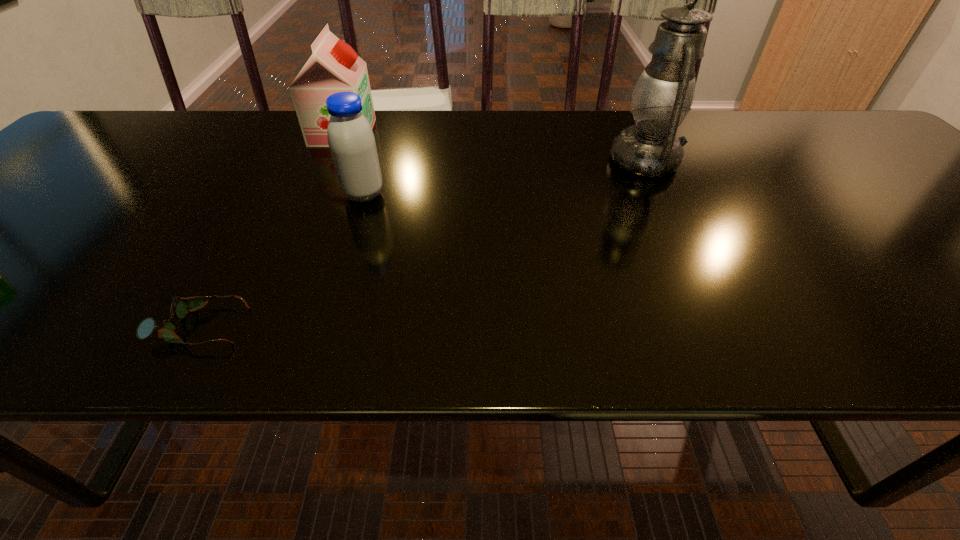
Find the location of a particular element. vacant space that's between the shortest object and the farther soya milk is located at coordinates (271, 230).

Where is `free point between the rightmost object and the farther soya milk`? free point between the rightmost object and the farther soya milk is located at coordinates (494, 146).

Identify which object is located as the third nearest to the nearest object. Please provide its 2D coordinates. Your answer should be formatted as a tuple, i.e. [(x, y)], where the tuple contains the x and y coordinates of a point satisfying the conditions above.

[(663, 95)]

Choose which object is the nearest neighbor to the nearest object. Please provide its 2D coordinates. Your answer should be formatted as a tuple, i.e. [(x, y)], where the tuple contains the x and y coordinates of a point satisfying the conditions above.

[(352, 144)]

Where is `vacant space that satisfies the following two spatial constraints: 1. with the cap open on the farther soya milk; 2. on the back side of the nearer soya milk`? vacant space that satisfies the following two spatial constraints: 1. with the cap open on the farther soya milk; 2. on the back side of the nearer soya milk is located at coordinates (315, 194).

Identify the location of free location that satisfies the following two spatial constraints: 1. with the cap open on the farther soya milk; 2. on the right side of the rightmost object. (330, 161).

The width and height of the screenshot is (960, 540). Identify the location of free point that satisfies the following two spatial constraints: 1. on the back side of the rightmost object; 2. on the left side of the nearer soya milk. (374, 161).